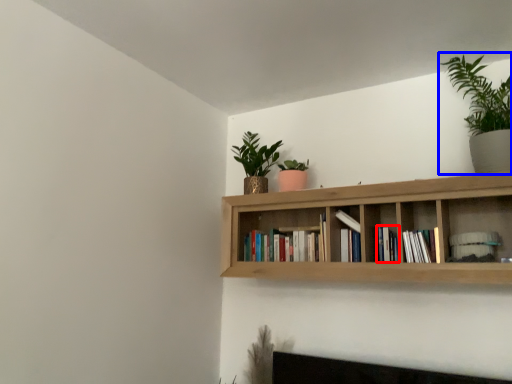
Question: Which object is further to the camera taking this photo, book (highlighted by a red box) or houseplant (highlighted by a blue box)?

Choices:
 (A) book
 (B) houseplant

Answer: (A)